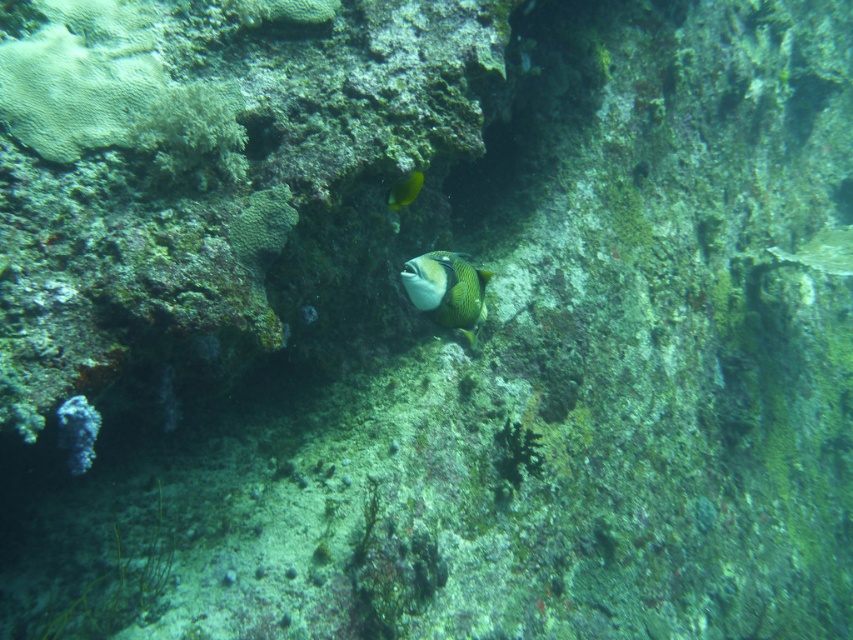
Does green textured fish at center have a smaller size compared to yellow matte fish at upper center?

No, green textured fish at center is not smaller than yellow matte fish at upper center.

Does point (434, 252) come in front of point (410, 176)?

No, it is behind (410, 176).

Image resolution: width=853 pixels, height=640 pixels. In order to click on green textured fish at center in this screenshot , I will do `click(447, 289)`.